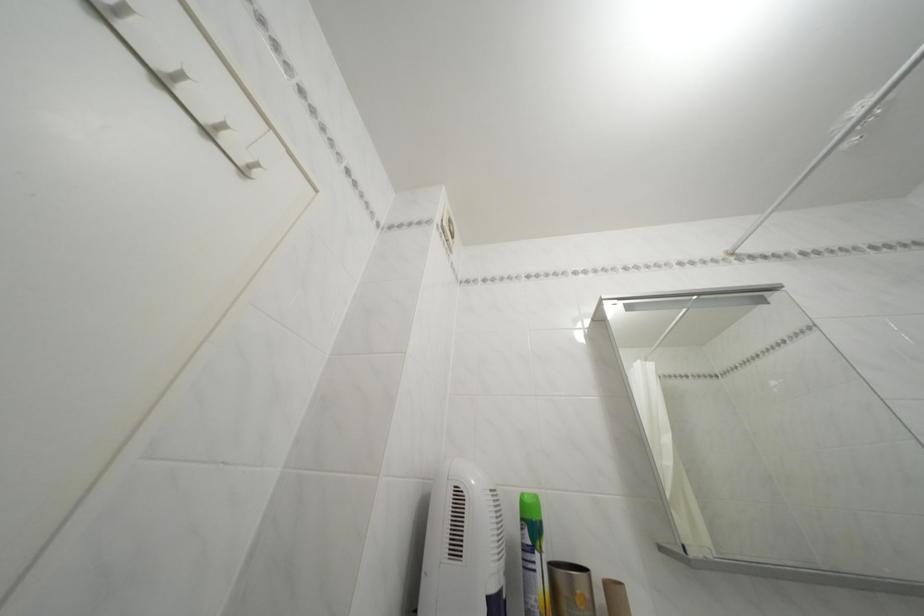
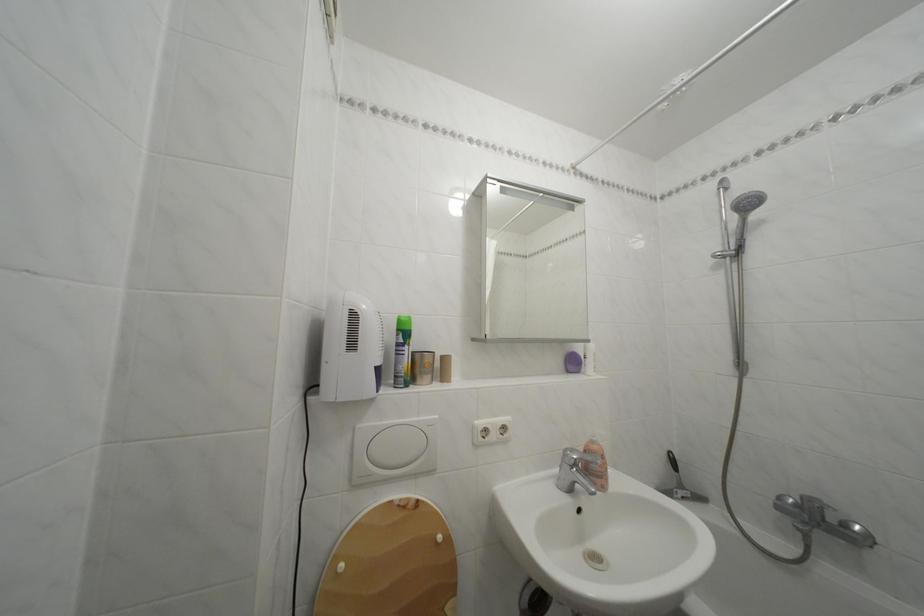
Find the pixel in the second image that matches point (531, 525) in the first image.

(407, 336)